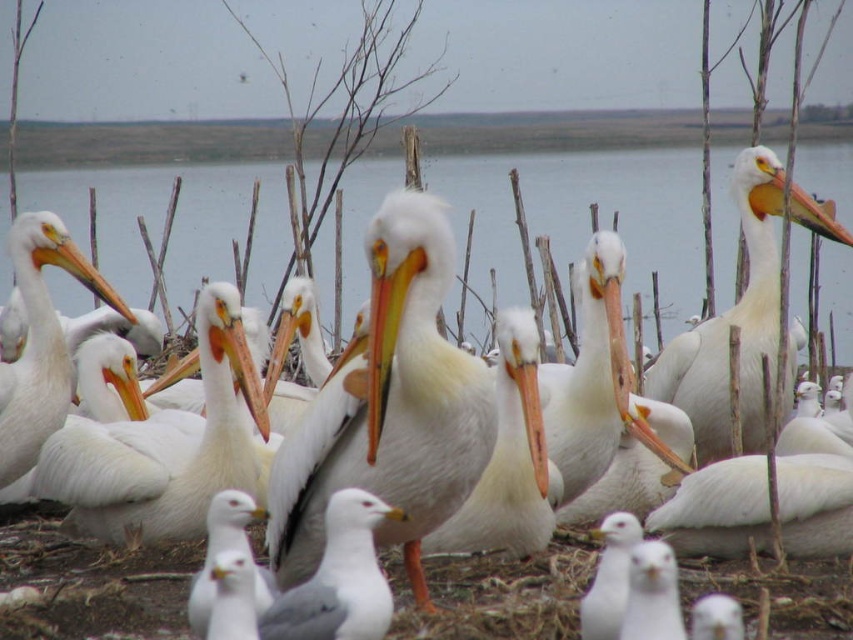
Does white matte pelican at left have a greater height compared to gray matte seagull at center?

Yes, white matte pelican at left is taller than gray matte seagull at center.

The width and height of the screenshot is (853, 640). What are the coordinates of `white matte pelican at left` in the screenshot? It's located at (41, 340).

Where is `white matte pelican at left`? This screenshot has width=853, height=640. white matte pelican at left is located at coordinates (x=41, y=340).

Is white matte pelican at upper right closer to camera compared to yellow-orange beak at upper right?

That is False.

Does point (769, 164) come closer to viewer compared to point (805, 204)?

That is False.

Consider the image. Measure the distance between white matte pelican at upper right and camera.

white matte pelican at upper right is 5.49 meters from camera.

The image size is (853, 640). I want to click on white matte pelican at upper right, so click(732, 324).

Which is more to the left, white matte pelican at upper right or matte orange beak at center?

Positioned to the left is matte orange beak at center.

Which of these two, white matte pelican at upper right or matte orange beak at center, stands shorter?

matte orange beak at center

Does point (732, 308) lie in front of point (61, 253)?

No, (732, 308) is behind (61, 253).

Find the location of a particular element. The image size is (853, 640). white matte pelican at upper right is located at coordinates (732, 324).